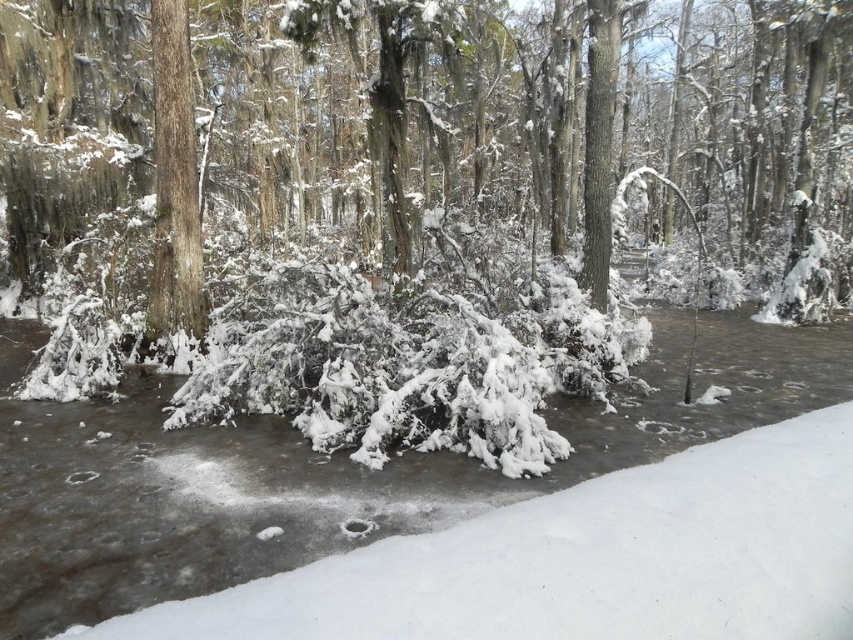
Question: Which object is closer to the camera taking this photo?

Choices:
 (A) white frosted stream at center
 (B) smooth bark tree at center

Answer: (A)

Question: Does white frosted stream at center appear under smooth bark tree at center?

Choices:
 (A) no
 (B) yes

Answer: (B)

Question: Can you confirm if white frosted stream at center is wider than smooth bark tree at center?

Choices:
 (A) yes
 (B) no

Answer: (A)

Question: Is white frosted stream at center below smooth bark tree at center?

Choices:
 (A) yes
 (B) no

Answer: (A)